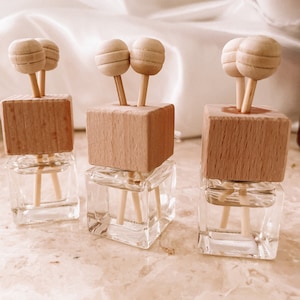
The image size is (300, 300). In order to click on glass in this screenshot , I will do `click(56, 207)`, `click(107, 221)`, `click(214, 244)`.